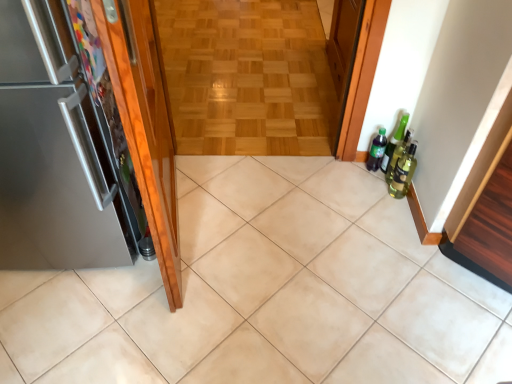
Find the location of `free point below shiny wood door at left, arranged as the first door when viewed from the right (from a real-world perspective)`. free point below shiny wood door at left, arranged as the first door when viewed from the right (from a real-world perspective) is located at coordinates (187, 228).